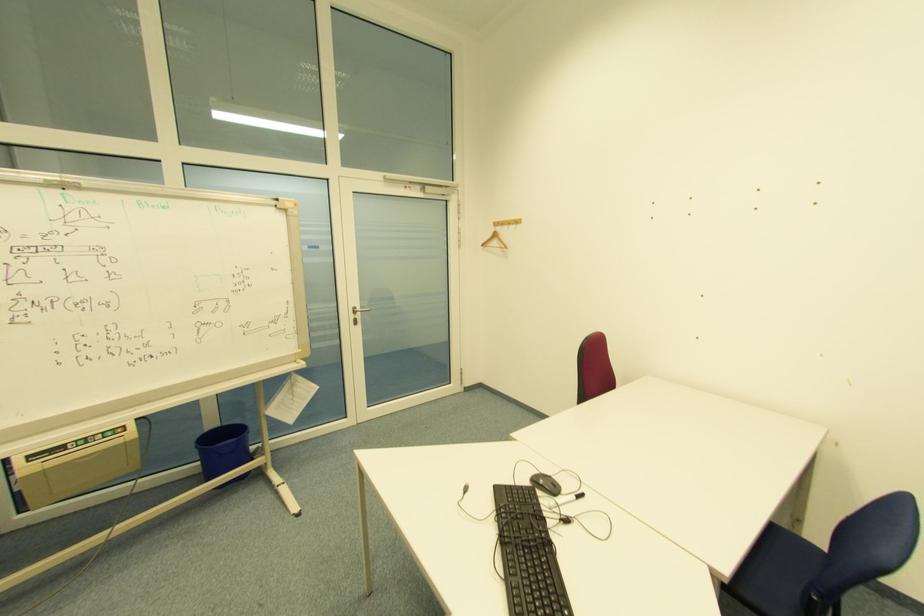
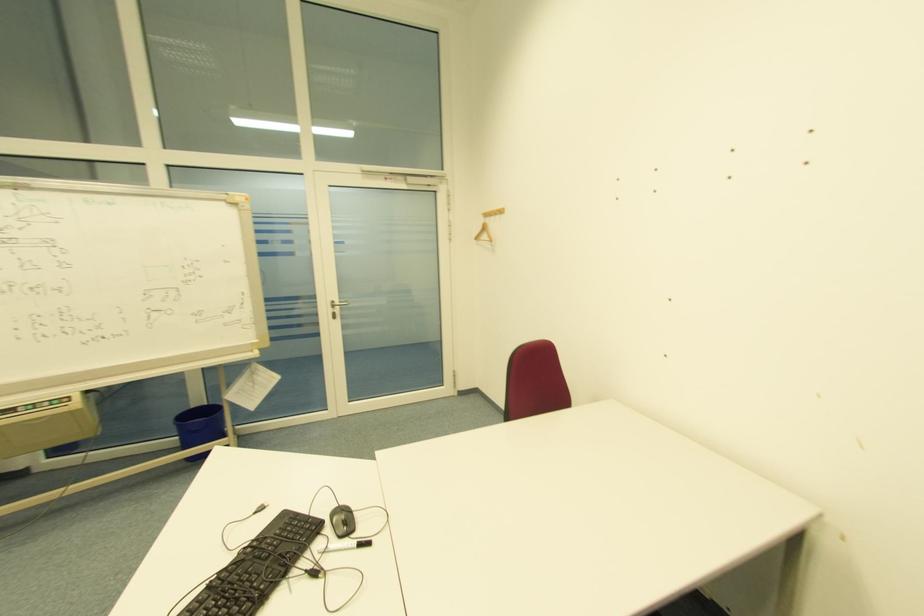
Question: The camera is either moving clockwise (left) or counter-clockwise (right) around the object. The first image is from the beginning of the video and the second image is from the end. Is the camera moving left or right when shooting the video?

Choices:
 (A) Left
 (B) Right

Answer: (B)